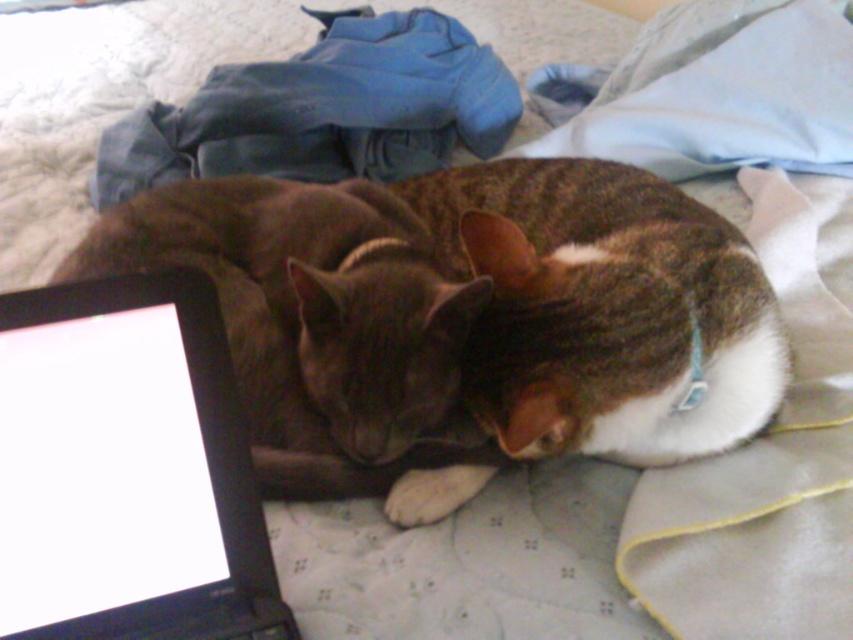
Does black plastic laptop at lower left have a greater width compared to dark brown fur cat at center?

In fact, black plastic laptop at lower left might be narrower than dark brown fur cat at center.

Who is positioned more to the right, black plastic laptop at lower left or dark brown fur cat at center?

From the viewer's perspective, dark brown fur cat at center appears more on the right side.

Does point (236, 444) lie behind point (358, 445)?

No, (236, 444) is in front of (358, 445).

Identify the location of black plastic laptop at lower left. Image resolution: width=853 pixels, height=640 pixels. (126, 468).